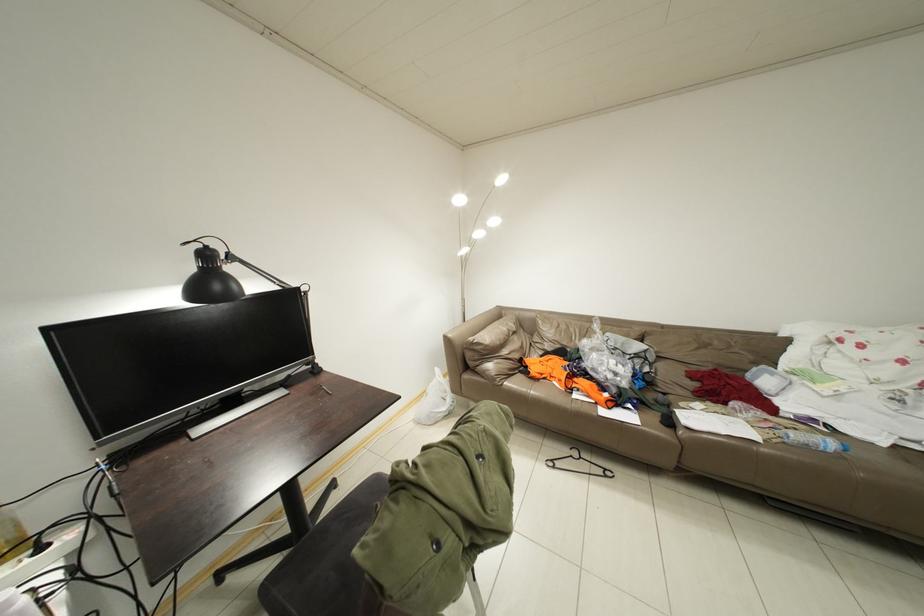
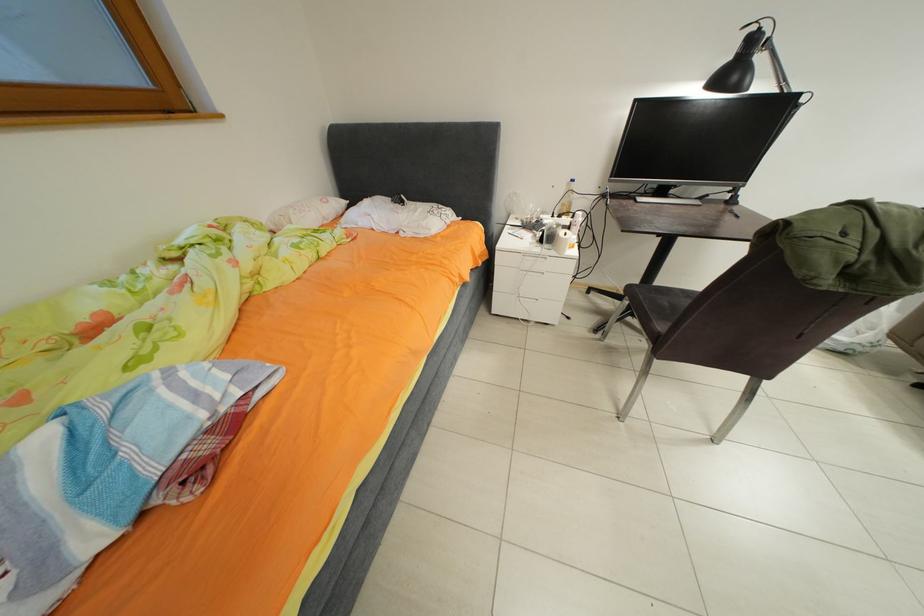
Based on the continuous images, in which direction is the camera rotating?

The camera rotated toward left-down.